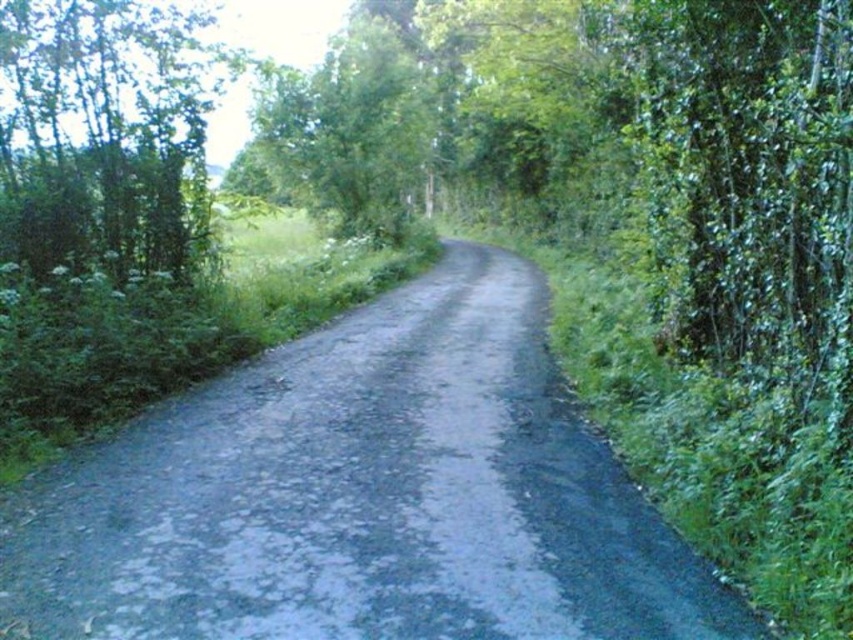
You are driving a delivery truck that is 2.5 meters wide. You need to navigate through the gray asphalt road at center. Considering the presence of the green leafy tree at left, will your truck fit on the road without touching the tree?

The gray asphalt road at center might be wider than green leafy tree at left, so there is a possibility that the truck can fit. However, since the exact width isn not specified, it is recommended to proceed with caution to avoid collision with the tree.

You are driving a delivery truck that is 2.5 meters wide. You come across a narrow road section where the gray asphalt road at center is only 3 meters wide. Can your truck safely pass through without hitting the green leafy tree at left?

The gray asphalt road at center is smaller than the green leafy tree at left. Since the road is only 3 meters wide and the truck is 2.5 meters wide, there is enough space for the truck to pass safely as long as it stays centered. However, the green leafy tree at left is larger, so the driver must ensure they keep to the right side of the road to avoid collision with the tree.